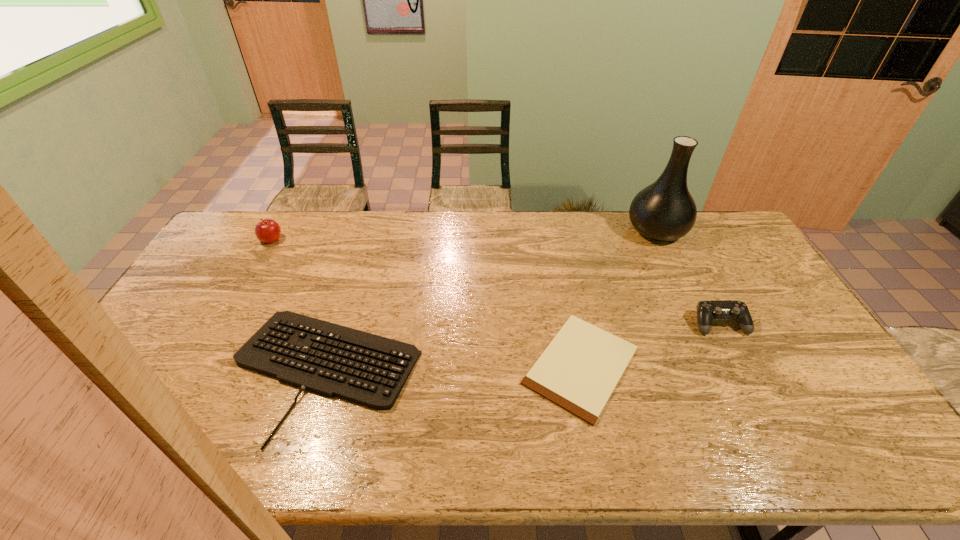
At what (x,y) coordinates should I click in order to perform the action: click on free space at the far right corner of the desktop. Please return your answer as a coordinate pair (x, y). Looking at the image, I should click on (704, 230).

Find the location of `free area in between the tallest object and the control`. free area in between the tallest object and the control is located at coordinates (688, 277).

The width and height of the screenshot is (960, 540). Find the location of `unoccupied area between the shortest object and the tallest object`. unoccupied area between the shortest object and the tallest object is located at coordinates (619, 298).

What are the coordinates of `free space that is in between the computer keyboard and the control` in the screenshot? It's located at (522, 348).

You are a GUI agent. You are given a task and a screenshot of the screen. Output one action in this format:
    pyautogui.click(x=<x>, y=<y>)
    Task: Click on the free space between the vase and the shortest object
    Image resolution: width=960 pixels, height=540 pixels.
    Given the screenshot: What is the action you would take?
    pyautogui.click(x=619, y=298)

Where is `vacant point located between the third tallest object and the fourth shortest object`? vacant point located between the third tallest object and the fourth shortest object is located at coordinates (495, 282).

The width and height of the screenshot is (960, 540). Find the location of `free space between the shortest object and the second tallest object`. free space between the shortest object and the second tallest object is located at coordinates (426, 302).

This screenshot has height=540, width=960. Find the location of `free area in between the second tallest object and the control`. free area in between the second tallest object and the control is located at coordinates (495, 282).

In order to click on vacant area that lies between the shortest object and the control in this screenshot , I will do `click(650, 345)`.

Where is `free space between the shortest object and the control`? The image size is (960, 540). free space between the shortest object and the control is located at coordinates (650, 345).